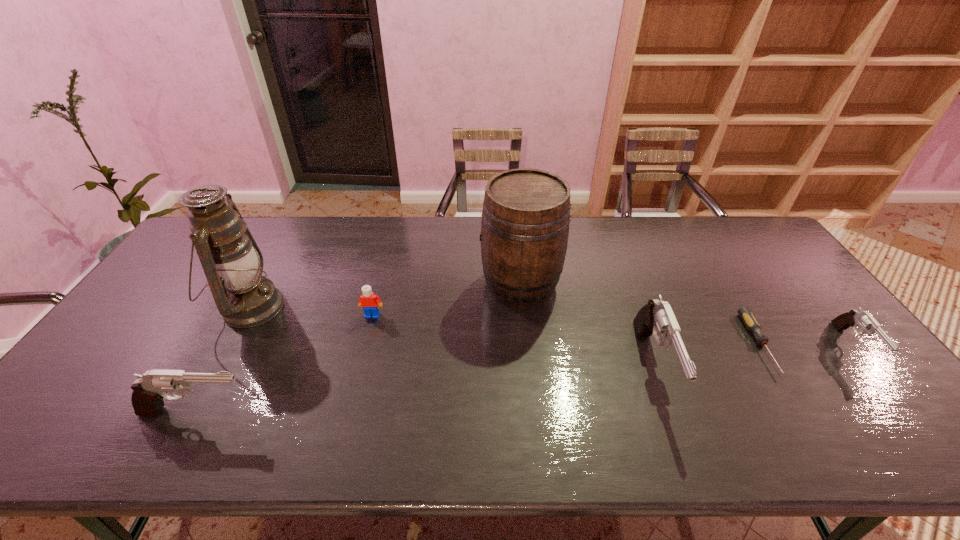
Locate an element on the screen. This screenshot has width=960, height=540. the third object from left to right is located at coordinates (368, 301).

At what (x,y) coordinates should I click in order to perform the action: click on vacant area situated 0.370m at the muzzle of the fourth shortest object. Please return your answer as a coordinate pair (x, y). Looking at the image, I should click on (414, 412).

Identify the location of free region located 0.070m at the muzzle of the rightmost object. The image size is (960, 540). (896, 398).

Identify the location of vacant region located 0.240m on the left of the oil lamp. click(x=136, y=307).

Where is `vacant space situated on the side of the sixth shortest object near the bung hole`? The width and height of the screenshot is (960, 540). vacant space situated on the side of the sixth shortest object near the bung hole is located at coordinates (444, 284).

Where is `free space located on the side of the sixth shortest object near the bung hole`? free space located on the side of the sixth shortest object near the bung hole is located at coordinates (357, 284).

Find the location of a particular element. Image resolution: width=960 pixels, height=540 pixels. vacant area located on the side of the sixth shortest object near the bung hole is located at coordinates [x=383, y=284].

In order to click on vacant region located on the face of the fifth object from right to left in this screenshot , I will do `click(350, 401)`.

This screenshot has height=540, width=960. In order to click on object that is at the right edge in this screenshot , I will do `click(854, 318)`.

In the image, there is a desktop. Where is `blank space at the far edge`? The width and height of the screenshot is (960, 540). blank space at the far edge is located at coordinates (411, 237).